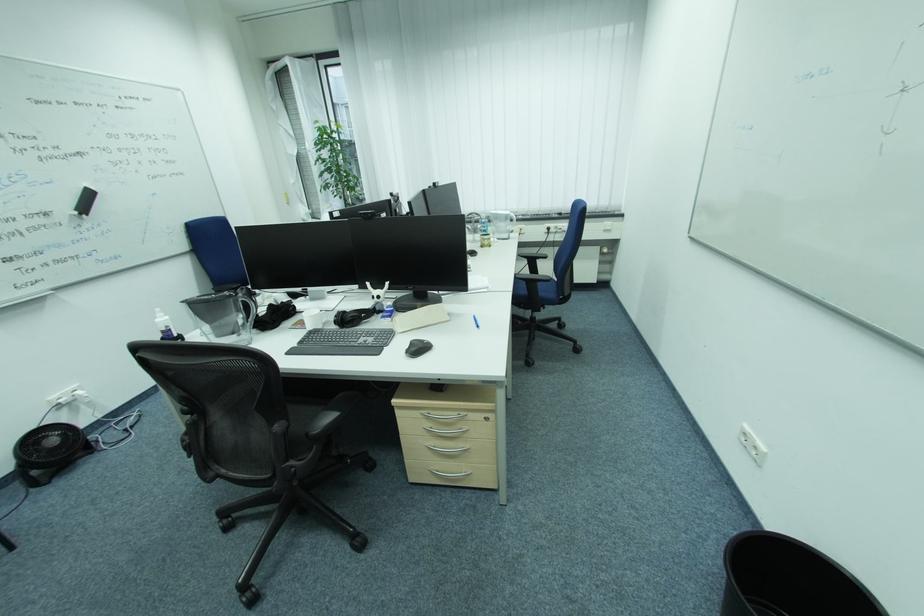
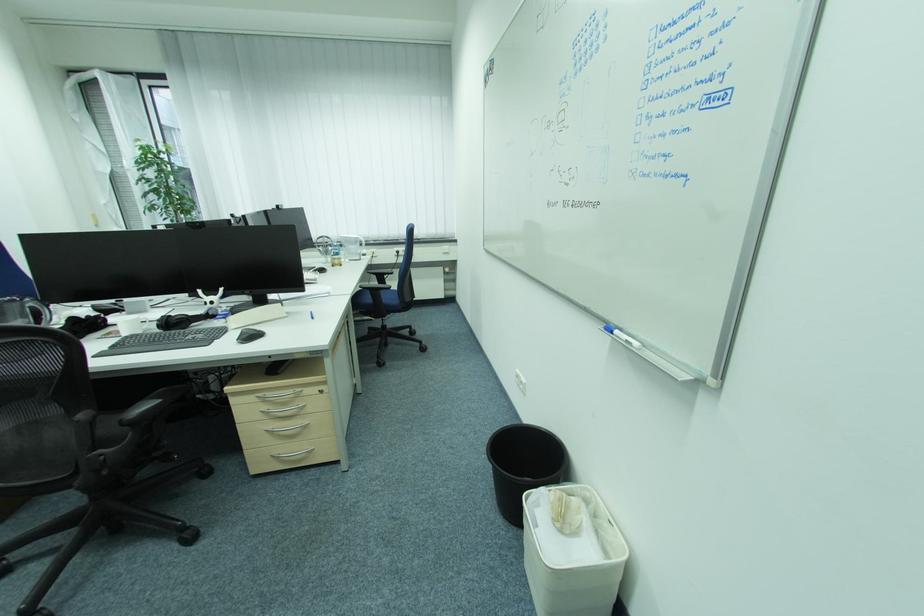
Question: The camera is either moving clockwise (left) or counter-clockwise (right) around the object. The first image is from the beginning of the video and the second image is from the end. Is the camera moving left or right when shooting the video?

Choices:
 (A) Left
 (B) Right

Answer: (A)